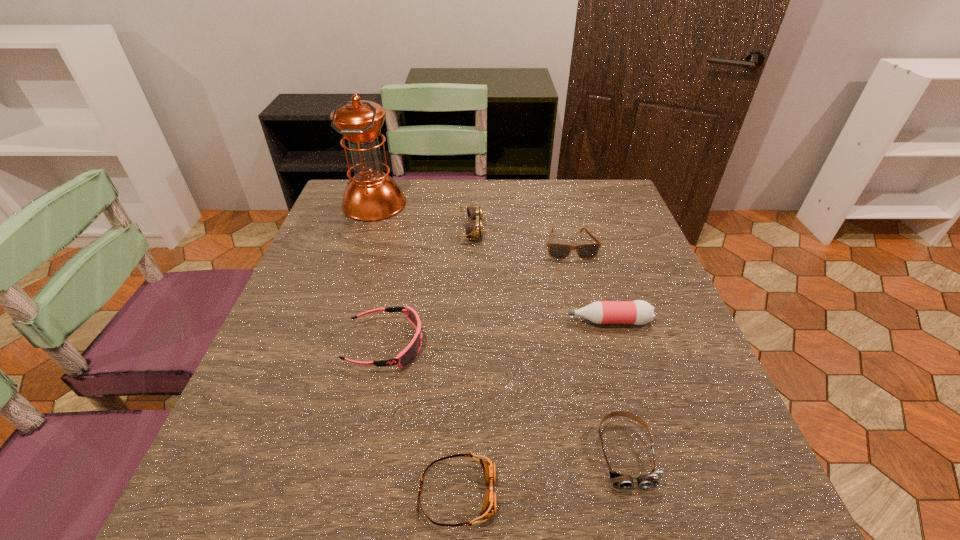
At what (x,y) coordinates should I click in order to perform the action: click on free region located with the cap open on the bottle. Please return your answer as a coordinate pair (x, y). Image resolution: width=960 pixels, height=540 pixels. Looking at the image, I should click on (385, 321).

This screenshot has height=540, width=960. I want to click on vacant region located on the front-facing side of the second farthest goggles, so click(x=519, y=344).

Where is `vacant area situated 0.400m on the frames of the sunglasses`? vacant area situated 0.400m on the frames of the sunglasses is located at coordinates (609, 402).

Image resolution: width=960 pixels, height=540 pixels. I want to click on vacant space located on the front-facing side of the rightmost goggles, so click(x=644, y=525).

The width and height of the screenshot is (960, 540). I want to click on oil lamp present at the far edge, so click(371, 195).

Locate an element on the screen. This screenshot has width=960, height=540. goggles at the far edge is located at coordinates (474, 229).

You are a GUI agent. You are given a task and a screenshot of the screen. Output one action in this format:
    pyautogui.click(x=<x>, y=<y>)
    Task: Click on the oil lamp that is at the left edge
    
    Given the screenshot: What is the action you would take?
    pyautogui.click(x=371, y=195)

The width and height of the screenshot is (960, 540). Identify the location of goggles at the left edge. (409, 353).

Identify the location of bottle located in the right edge section of the desktop. (638, 312).

The height and width of the screenshot is (540, 960). What are the coordinates of `sunglasses that is at the right edge` in the screenshot? It's located at (556, 251).